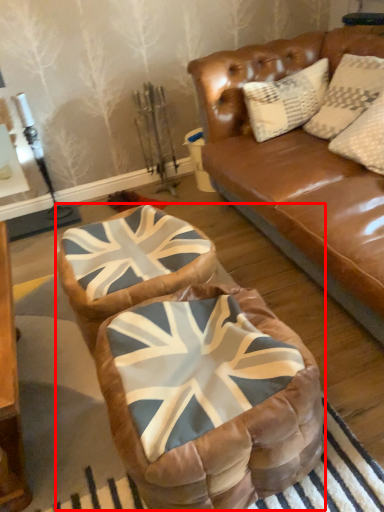
Question: From the image, what is the correct spatial relationship of bean bag chair (annotated by the red box) in relation to swivel chair?

Choices:
 (A) left
 (B) right

Answer: (B)